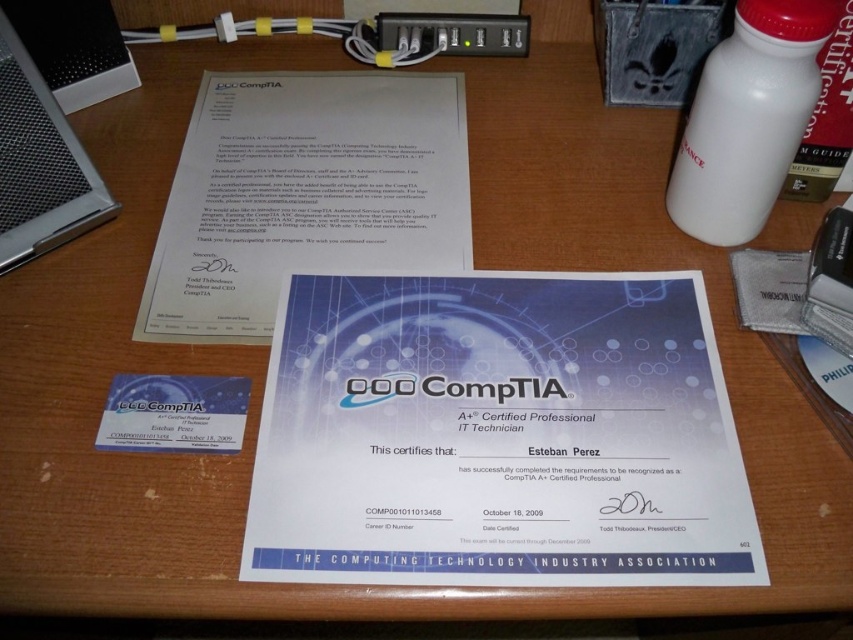
Question: Which object appears closest to the camera in this image?

Choices:
 (A) white paper at center
 (B) white paper certificate at center

Answer: (B)

Question: Which object is farther from the camera taking this photo?

Choices:
 (A) white paper at center
 (B) silver metallic computer at upper left
 (C) black plastic usb port at upper center
 (D) white matte bottle at upper right

Answer: (C)

Question: Is the position of white paper at center more distant than that of black plastic usb port at upper center?

Choices:
 (A) yes
 (B) no

Answer: (B)

Question: Which object is closer to the camera taking this photo?

Choices:
 (A) white matte bottle at upper right
 (B) silver metallic computer at upper left
 (C) white paper certificate at center
 (D) white paper at center

Answer: (C)

Question: Can you confirm if white matte bottle at upper right is positioned above silver metallic computer at upper left?

Choices:
 (A) yes
 (B) no

Answer: (A)

Question: Is white paper at center below white matte bottle at upper right?

Choices:
 (A) no
 (B) yes

Answer: (B)